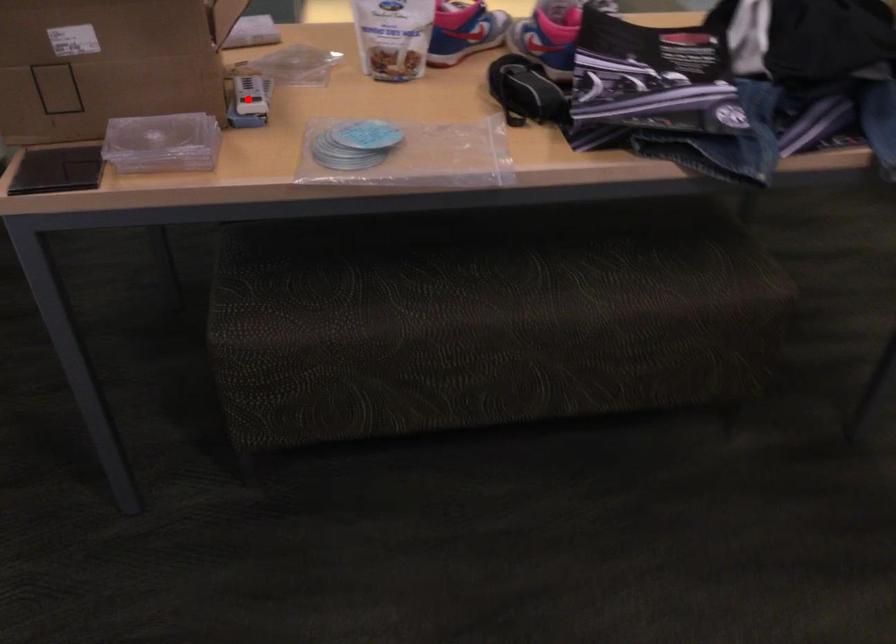
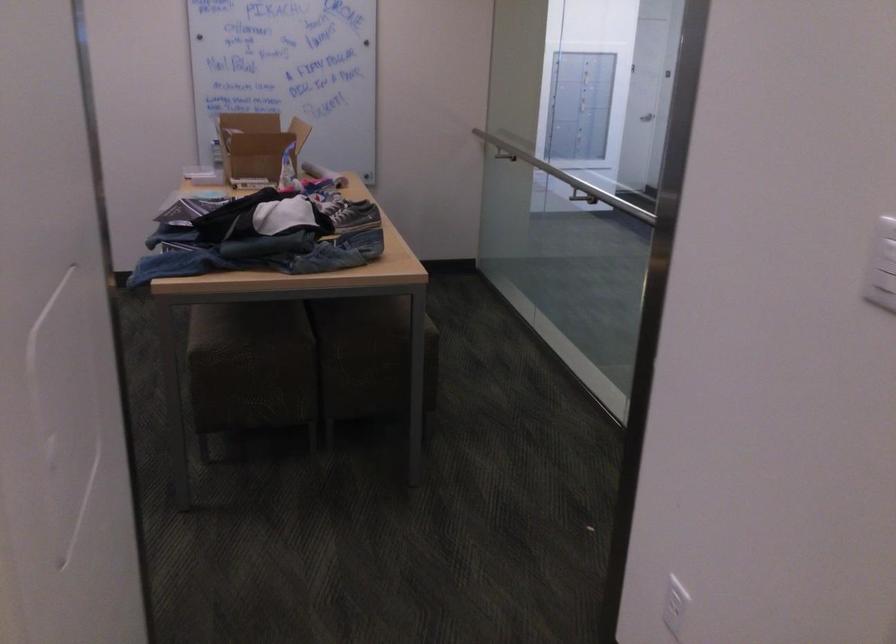
Question: I am providing you with two images of the same scene from different viewpoints. A red point is marked on the first image. At the location where the point appears in image 1, is it still visible in image 2?

Choices:
 (A) Yes
 (B) No

Answer: (B)